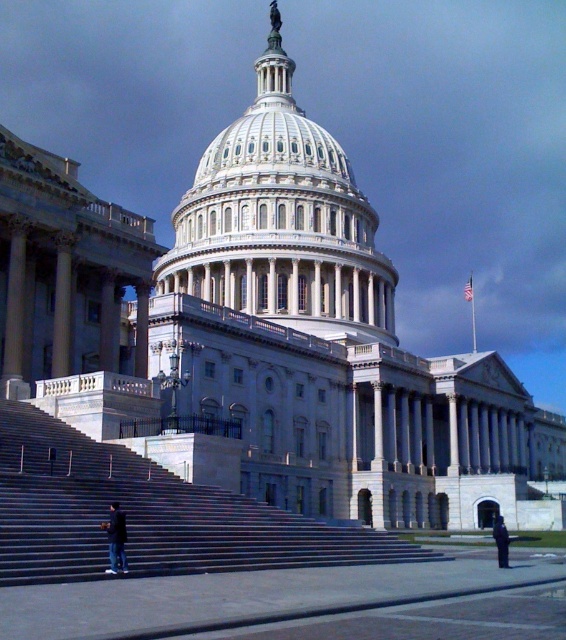
Question: Which of the following is the closest to the observer?

Choices:
 (A) gray concrete stairs at lower left
 (B) dark blue jeans at lower left

Answer: (A)

Question: Does gray concrete stairs at lower left have a greater width compared to dark blue uniform at lower right?

Choices:
 (A) yes
 (B) no

Answer: (A)

Question: Among these objects, which one is nearest to the camera?

Choices:
 (A) dark blue jeans at lower left
 (B) gray concrete stairs at lower left

Answer: (B)

Question: Is gray concrete stairs at lower left positioned behind dark blue uniform at lower right?

Choices:
 (A) no
 (B) yes

Answer: (A)

Question: Does gray concrete stairs at lower left lie in front of dark blue jeans at lower left?

Choices:
 (A) no
 (B) yes

Answer: (B)

Question: Which object is positioned closest to the dark blue jeans at lower left?

Choices:
 (A) dark blue uniform at lower right
 (B) gray concrete stairs at lower left

Answer: (B)